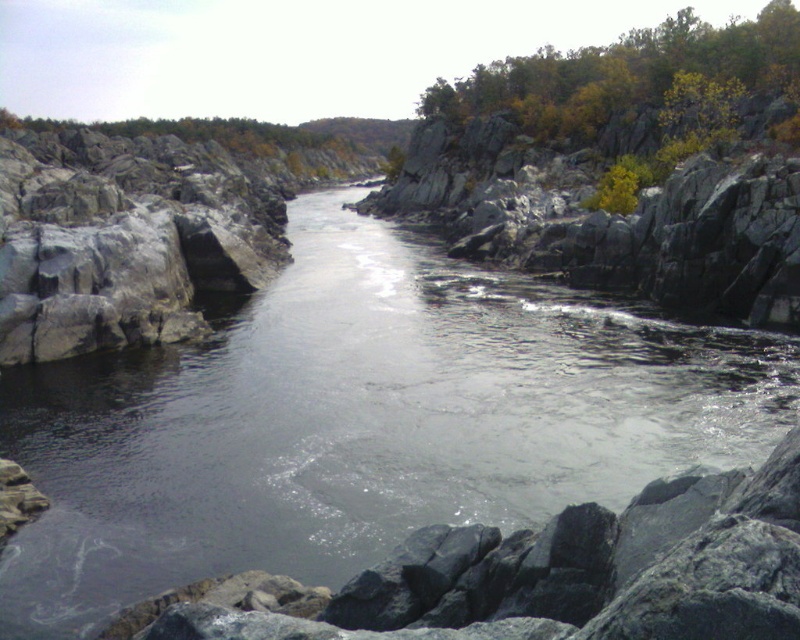
Question: Among these objects, which one is nearest to the camera?

Choices:
 (A) yellow-green foliage at upper right
 (B) gray/rocky river at center

Answer: (B)

Question: Considering the relative positions of gray/rocky river at center and yellow-green foliage at upper right in the image provided, where is gray/rocky river at center located with respect to yellow-green foliage at upper right?

Choices:
 (A) right
 (B) left

Answer: (B)

Question: Does gray/rocky river at center appear under yellow-green foliage at upper right?

Choices:
 (A) yes
 (B) no

Answer: (A)

Question: Which point is closer to the camera?

Choices:
 (A) gray/rocky river at center
 (B) yellow-green foliage at upper right

Answer: (A)

Question: Is gray/rocky river at center in front of yellow-green foliage at upper right?

Choices:
 (A) no
 (B) yes

Answer: (B)